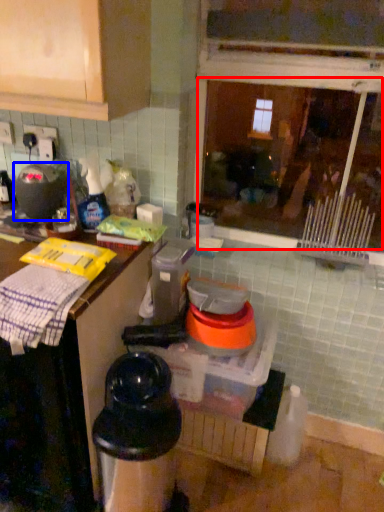
Question: Which of the following is the farthest to the observer, window (highlighted by a red box) or appliance (highlighted by a blue box)?

Choices:
 (A) window
 (B) appliance

Answer: (B)